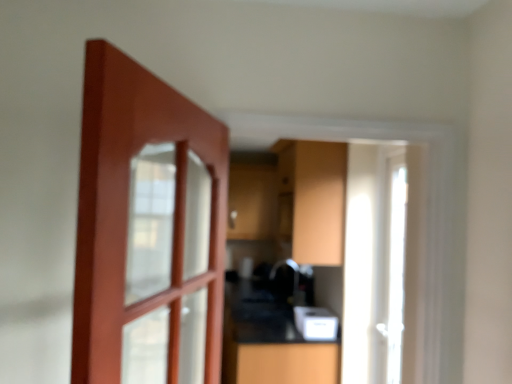
Question: Does white plastic toaster at lower center have a larger size compared to matte wood cabinet at center?

Choices:
 (A) no
 (B) yes

Answer: (A)

Question: Can you confirm if white plastic toaster at lower center is thinner than matte wood cabinet at center?

Choices:
 (A) yes
 (B) no

Answer: (A)

Question: Is white plastic toaster at lower center positioned with its back to matte wood cabinet at center?

Choices:
 (A) no
 (B) yes

Answer: (A)

Question: Is matte wood cabinet at center located within white plastic toaster at lower center?

Choices:
 (A) no
 (B) yes

Answer: (A)

Question: Does white plastic toaster at lower center have a greater width compared to matte wood cabinet at center?

Choices:
 (A) no
 (B) yes

Answer: (A)

Question: From the image's perspective, is white plastic toaster at lower center under matte wood cabinet at center?

Choices:
 (A) no
 (B) yes

Answer: (B)

Question: Does white glossy door at right come behind white plastic toaster at lower center?

Choices:
 (A) no
 (B) yes

Answer: (A)

Question: Is white glossy door at right positioned far away from white plastic toaster at lower center?

Choices:
 (A) yes
 (B) no

Answer: (A)

Question: Is white glossy door at right wider than white plastic toaster at lower center?

Choices:
 (A) no
 (B) yes

Answer: (A)

Question: Can you confirm if white glossy door at right is smaller than white plastic toaster at lower center?

Choices:
 (A) yes
 (B) no

Answer: (B)

Question: Does white glossy door at right have a larger size compared to white plastic toaster at lower center?

Choices:
 (A) no
 (B) yes

Answer: (B)

Question: Is white glossy door at right completely or partially outside of white plastic toaster at lower center?

Choices:
 (A) yes
 (B) no

Answer: (A)

Question: Is white glossy door at right behind matte wood cabinet at center?

Choices:
 (A) yes
 (B) no

Answer: (B)